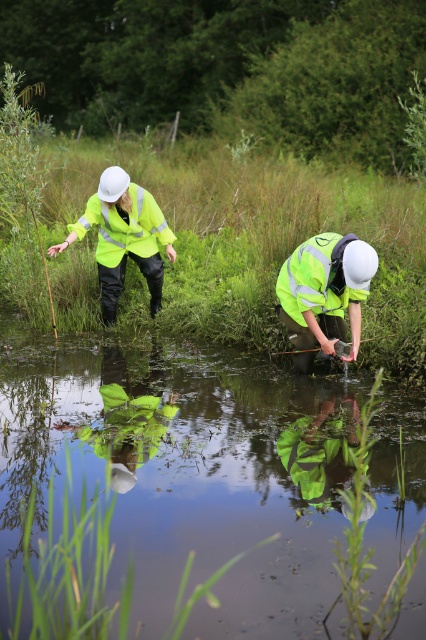
You are a drone operator trying to capture a closeup of the point at coordinates (127, 220). The drone can only fly within 25 feet of the camera. Can the drone safely reach the point?

The point at coordinates (127, 220) is 24.67 feet from the camera, so yes, the drone can safely reach it as it is within the 25 feet limit.

You are a field researcher who needs to move from the point marked at coordinates (354, 321) to the point marked at (290, 301). Given the scene described, which direction should you move to reach your destination?

To move from point (354, 321) to point (290, 301), you should move backward since point (354, 321) is in front of point (290, 301).